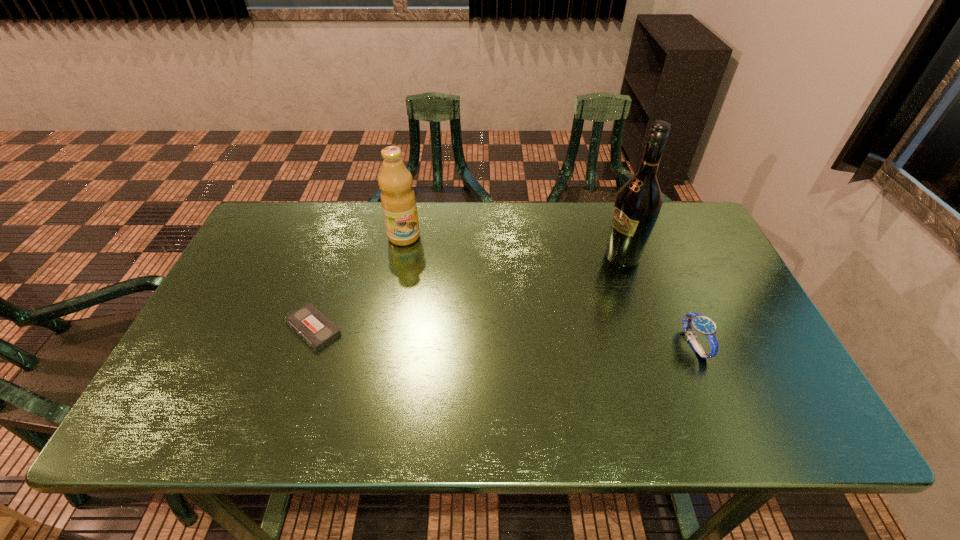
This screenshot has width=960, height=540. In order to click on object present at the near right corner in this screenshot , I will do `click(704, 326)`.

Locate an element on the screen. The height and width of the screenshot is (540, 960). blank space at the far edge of the desktop is located at coordinates (337, 238).

Identify the location of free space at the near edge of the desktop. (436, 368).

In the image, there is a desktop. At what (x,y) coordinates should I click in order to perform the action: click on vacant region at the right edge. Please return your answer as a coordinate pair (x, y). Image resolution: width=960 pixels, height=540 pixels. Looking at the image, I should click on (684, 264).

Locate an element on the screen. This screenshot has width=960, height=540. vacant space at the far left corner of the desktop is located at coordinates (268, 231).

The width and height of the screenshot is (960, 540). Identify the location of free spot at the far right corner of the desktop. (706, 233).

The image size is (960, 540). I want to click on vacant area that lies between the videotape and the second object from right to left, so pyautogui.click(x=468, y=293).

Where is `vacant space in between the third tallest object and the shortest object`? This screenshot has width=960, height=540. vacant space in between the third tallest object and the shortest object is located at coordinates (504, 336).

The width and height of the screenshot is (960, 540). In order to click on free area in between the rightmost object and the third object from left to right in this screenshot , I will do `click(659, 300)`.

This screenshot has width=960, height=540. Find the location of `vacant area between the watch and the videotape`. vacant area between the watch and the videotape is located at coordinates (504, 336).